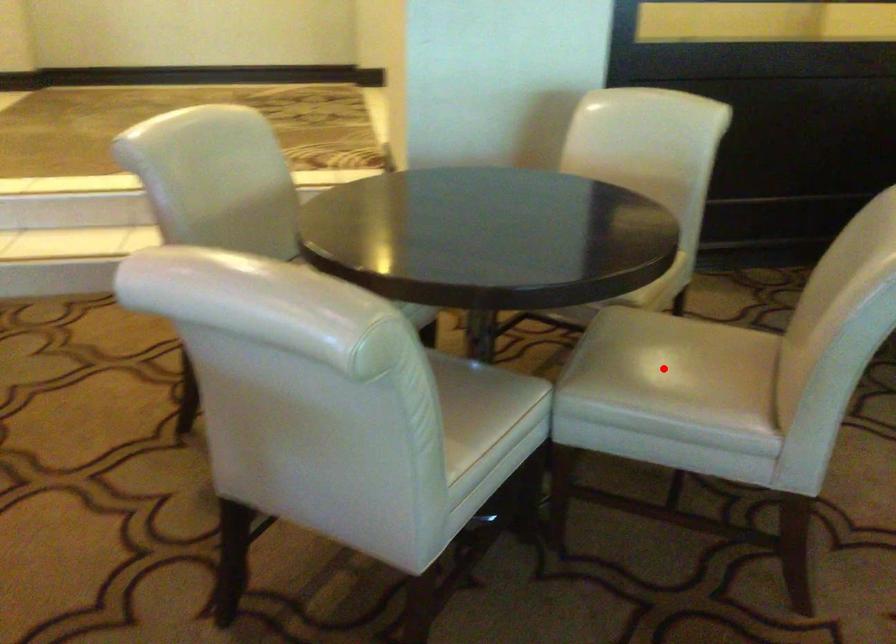
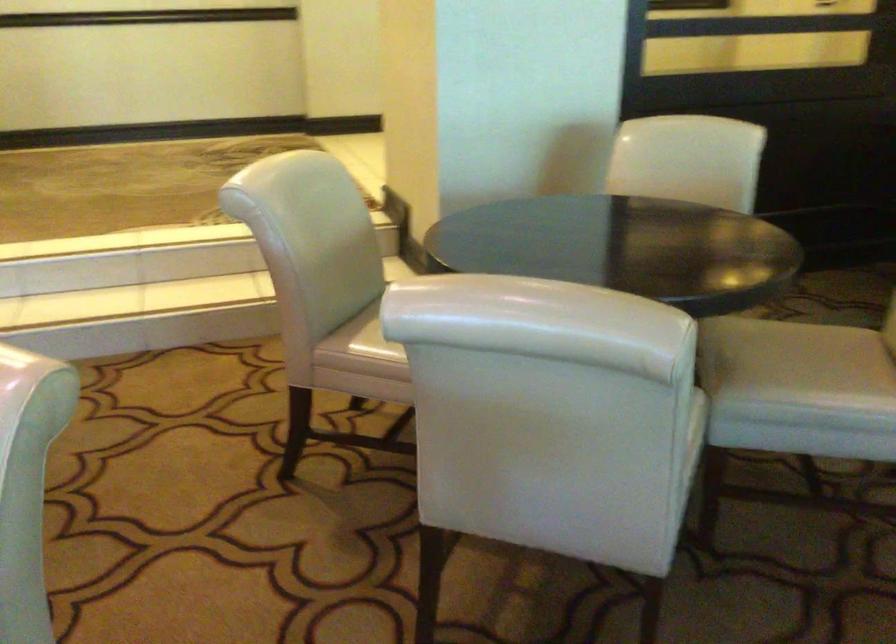
Locate, in the second image, the point that corresponds to the highlighted location in the first image.

(796, 363)